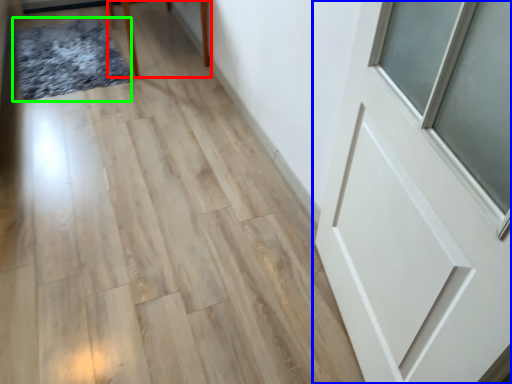
Question: Which object is positioned closest to furniture (highlighted by a red box)? Select from door (highlighted by a blue box) and mat (highlighted by a green box).

Choices:
 (A) door
 (B) mat

Answer: (B)